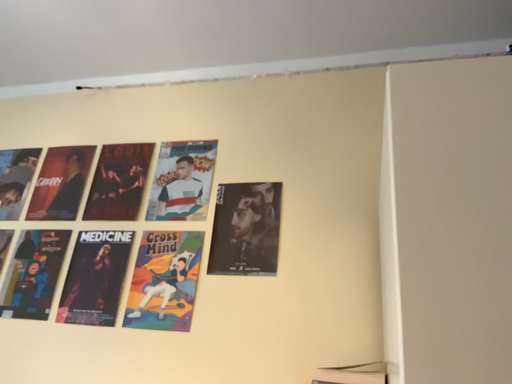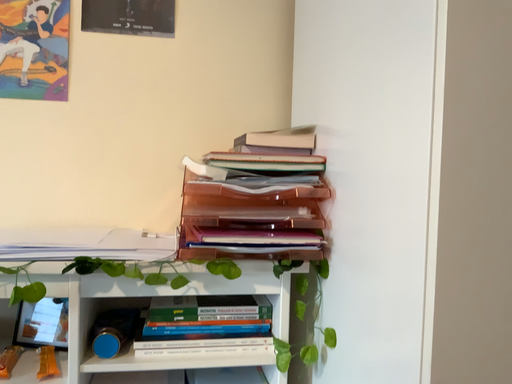
Question: Which way did the camera rotate in the video?

Choices:
 (A) rotated right
 (B) rotated left

Answer: (A)